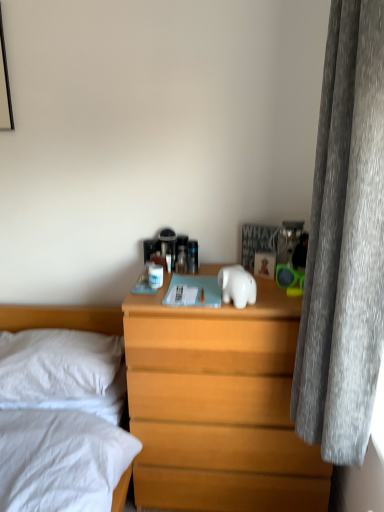
Question: Considering their positions, is white glossy elephant at center located in front of or behind wooden nightstand at center?

Choices:
 (A) front
 (B) behind

Answer: (A)

Question: Is white glossy elephant at center bigger or smaller than wooden nightstand at center?

Choices:
 (A) big
 (B) small

Answer: (B)

Question: Considering the real-world distances, which object is farthest from the gray velvet curtain at right?

Choices:
 (A) white soft pillow at left
 (B) wooden nightstand at center
 (C) white glossy elephant at center

Answer: (A)

Question: Considering the real-world distances, which object is farthest from the white soft pillow at left?

Choices:
 (A) wooden nightstand at center
 (B) gray velvet curtain at right
 (C) white glossy elephant at center

Answer: (B)